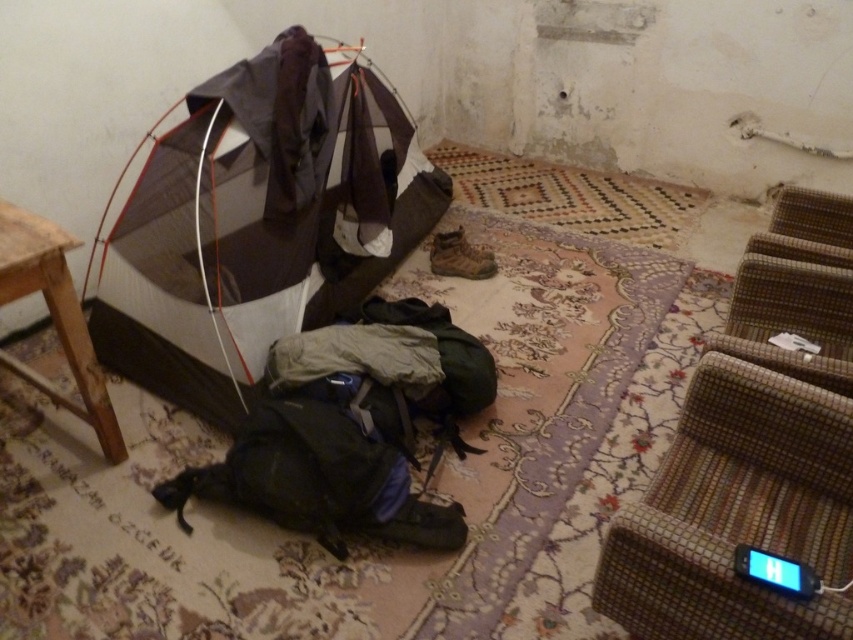
Question: Is brown woven stool at lower right to the left of wooden stool at lower left from the viewer's perspective?

Choices:
 (A) yes
 (B) no

Answer: (B)

Question: Which of these objects is positioned closest to the black fabric sleeping bag at center?

Choices:
 (A) brown woven stool at lower right
 (B) wooden stool at lower left
 (C) gray fabric tent at center

Answer: (B)

Question: Which point appears farthest from the camera in this image?

Choices:
 (A) (729, 512)
 (B) (4, 234)
 (C) (451, 548)
 (D) (236, 417)

Answer: (D)

Question: Does gray fabric tent at center appear over black fabric sleeping bag at center?

Choices:
 (A) no
 (B) yes

Answer: (B)

Question: Is gray fabric tent at center positioned at the back of brown woven stool at lower right?

Choices:
 (A) no
 (B) yes

Answer: (B)

Question: Considering the real-world distances, which object is farthest from the black fabric sleeping bag at center?

Choices:
 (A) brown woven stool at lower right
 (B) gray fabric tent at center

Answer: (A)